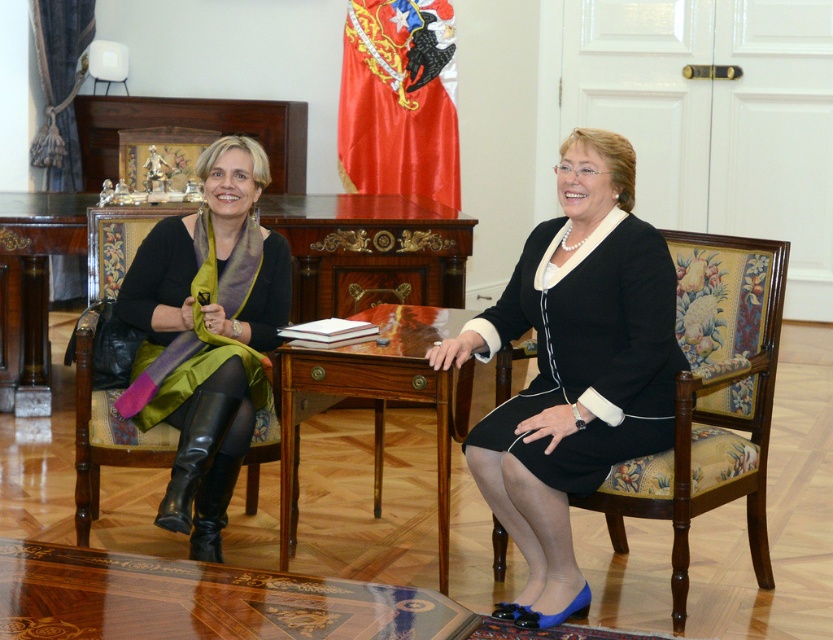
Question: Is marquetry wood table at center wider than velvet green chair at left?

Choices:
 (A) no
 (B) yes

Answer: (B)

Question: Does velvet floral-patterned chair at center appear over green silk scarf at left?

Choices:
 (A) no
 (B) yes

Answer: (A)

Question: Observing the image, what is the correct spatial positioning of velvet floral-patterned chair at center in reference to velvet green chair at left?

Choices:
 (A) below
 (B) above

Answer: (A)

Question: Which object is the closest to the velvet green chair at left?

Choices:
 (A) marquetry wood table at center
 (B) black matte dress at center
 (C) glossy wood table at center
 (D) black satin dress at center

Answer: (C)

Question: Considering the real-world distances, which object is closest to the glossy wood table at center?

Choices:
 (A) green silk scarf at left
 (B) marquetry wood table at center

Answer: (A)

Question: Which point is closer to the camera taking this photo?

Choices:
 (A) (764, 330)
 (B) (373, 396)

Answer: (B)